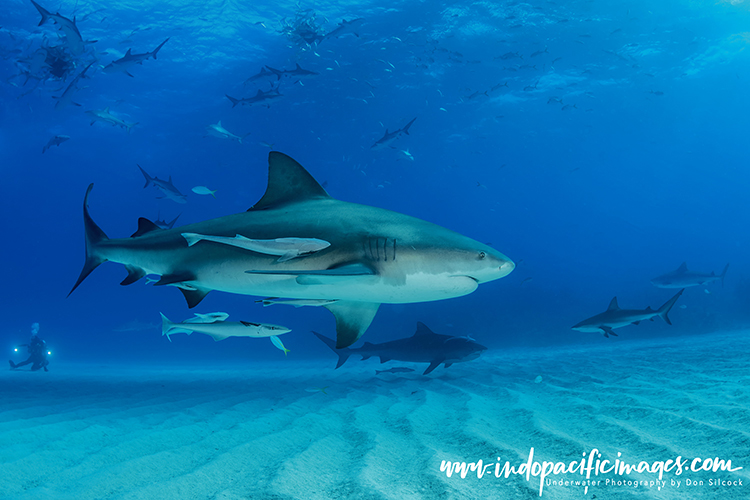
Locate an element on the screen. Image resolution: width=750 pixels, height=500 pixels. light is located at coordinates (50, 352).